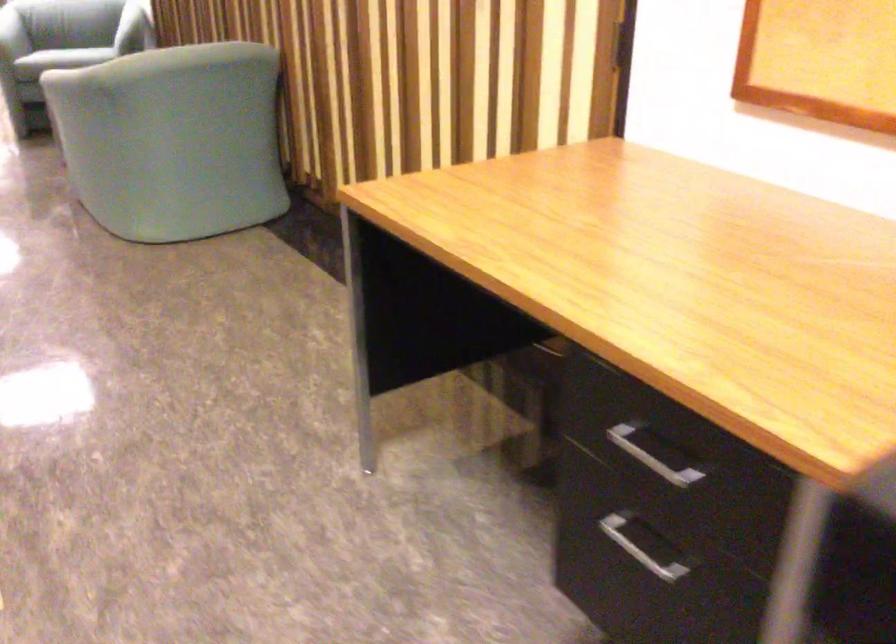
I want to click on chair armrest, so click(x=12, y=35).